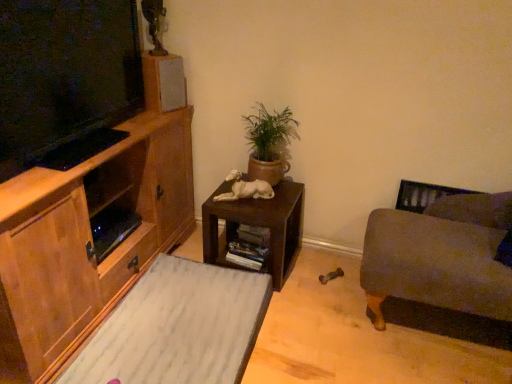
Question: Is point (234, 170) positioned closer to the camera than point (182, 139)?

Choices:
 (A) closer
 (B) farther

Answer: (B)

Question: Based on their sizes in the image, would you say white glossy statue at center is bigger or smaller than wooden cabinet at left?

Choices:
 (A) small
 (B) big

Answer: (A)

Question: Estimate the real-world distances between objects in this image. Which object is farther from the velvet gray couch at right?

Choices:
 (A) wooden cabinet at left
 (B) white glossy statue at center
 (C) green terracotta pot at center
 (D) white marble rug at lower left
 (E) dark brown wooden table at center

Answer: (A)

Question: Based on their relative distances, which object is farther from the wooden cabinet at left?

Choices:
 (A) green terracotta pot at center
 (B) white glossy statue at center
 (C) white marble rug at lower left
 (D) velvet gray couch at right
 (E) matte gray speaker at upper center

Answer: (D)